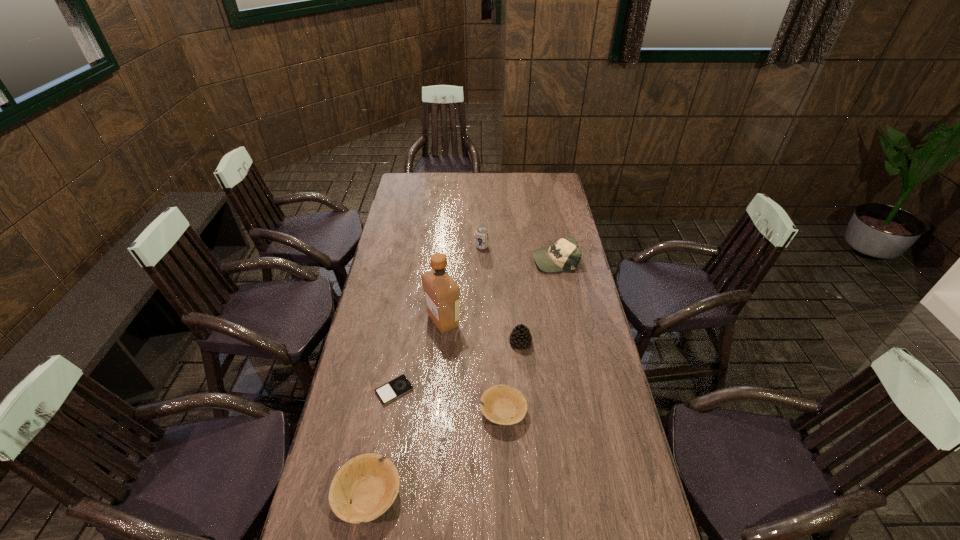
Where is `free area in between the baseball cap and the pinecone`? free area in between the baseball cap and the pinecone is located at coordinates (538, 301).

The image size is (960, 540). I want to click on free space between the left bowl and the farther bowl, so click(436, 453).

The width and height of the screenshot is (960, 540). Find the location of `empty location between the beer can and the baseball cap`. empty location between the beer can and the baseball cap is located at coordinates (518, 253).

At what (x,y) coordinates should I click in order to perform the action: click on vacant area that lies between the shortest object and the pinecone. Please return your answer as a coordinate pair (x, y). This screenshot has width=960, height=540. Looking at the image, I should click on (457, 367).

The image size is (960, 540). What are the coordinates of `free space between the iPod and the pinecone` in the screenshot? It's located at (457, 367).

Where is `empty space between the beer can and the pinecone`? empty space between the beer can and the pinecone is located at coordinates (501, 295).

Locate an element on the screen. This screenshot has height=540, width=960. unoccupied position between the tallest object and the beer can is located at coordinates (463, 284).

The image size is (960, 540). I want to click on object that is the fifth closest to the baseball cap, so click(x=399, y=386).

Select which object is the second closest to the beer can. Please provide its 2D coordinates. Your answer should be formatted as a tuple, i.e. [(x, y)], where the tuple contains the x and y coordinates of a point satisfying the conditions above.

[(442, 294)]

Locate an element on the screen. vacant space that satisfies the following two spatial constraints: 1. on the front side of the shorter bowl; 2. on the left side of the beer can is located at coordinates (483, 411).